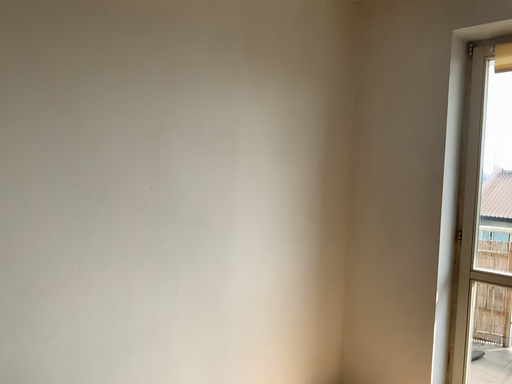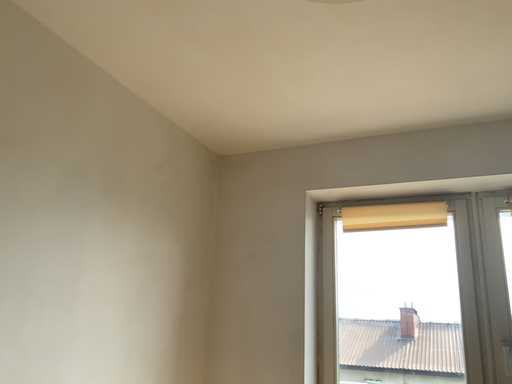
Question: Which way did the camera rotate in the video?

Choices:
 (A) rotated left
 (B) rotated right

Answer: (B)